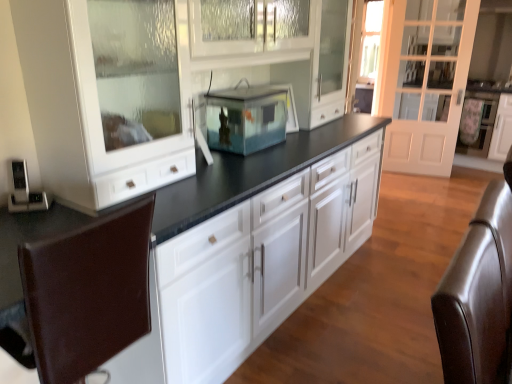
Question: Considering the relative sizes of white glass door at right and brown leather swivel chair at right, marked as the 1th swivel chair in a right-to-left arrangement, in the image provided, is white glass door at right shorter than brown leather swivel chair at right, marked as the 1th swivel chair in a right-to-left arrangement,?

Choices:
 (A) yes
 (B) no

Answer: (B)

Question: Does white glass door at right have a greater width compared to brown leather swivel chair at right, the 2th swivel chair viewed from the left?

Choices:
 (A) yes
 (B) no

Answer: (B)

Question: Is white glass door at right behind brown leather swivel chair at right, marked as the 1th swivel chair in a right-to-left arrangement?

Choices:
 (A) yes
 (B) no

Answer: (A)

Question: Does white glass door at right appear on the left side of brown leather swivel chair at right, marked as the 1th swivel chair in a right-to-left arrangement?

Choices:
 (A) yes
 (B) no

Answer: (B)

Question: From a real-world perspective, is white glass door at right over brown leather swivel chair at right, the 2th swivel chair viewed from the left?

Choices:
 (A) yes
 (B) no

Answer: (A)

Question: Considering the relative positions of brown leather swivel chair at right, marked as the 1th swivel chair in a right-to-left arrangement, and brown leather swivel chair at lower left, which is counted as the first swivel chair, starting from the left, in the image provided, is brown leather swivel chair at right, marked as the 1th swivel chair in a right-to-left arrangement, to the left or to the right of brown leather swivel chair at lower left, which is counted as the first swivel chair, starting from the left,?

Choices:
 (A) right
 (B) left

Answer: (A)

Question: From a real-world perspective, is brown leather swivel chair at right, marked as the 1th swivel chair in a right-to-left arrangement, physically located above or below brown leather swivel chair at lower left, the second swivel chair when ordered from right to left?

Choices:
 (A) below
 (B) above

Answer: (B)

Question: Considering the positions of brown leather swivel chair at right, the 2th swivel chair viewed from the left, and brown leather swivel chair at lower left, the second swivel chair when ordered from right to left, in the image, is brown leather swivel chair at right, the 2th swivel chair viewed from the left, wider or thinner than brown leather swivel chair at lower left, the second swivel chair when ordered from right to left,?

Choices:
 (A) wide
 (B) thin

Answer: (B)

Question: From the image's perspective, is brown leather swivel chair at right, marked as the 1th swivel chair in a right-to-left arrangement, positioned above or below brown leather swivel chair at lower left, the second swivel chair when ordered from right to left?

Choices:
 (A) above
 (B) below

Answer: (A)

Question: From their relative heights in the image, would you say white glass door at right is taller or shorter than transparent glass fish tank at center?

Choices:
 (A) short
 (B) tall

Answer: (B)

Question: Considering the positions of white glass door at right and transparent glass fish tank at center in the image, is white glass door at right wider or thinner than transparent glass fish tank at center?

Choices:
 (A) thin
 (B) wide

Answer: (A)

Question: Relative to transparent glass fish tank at center, is white glass door at right in front or behind?

Choices:
 (A) front
 (B) behind

Answer: (B)

Question: Considering the positions of point coord(415,72) and point coord(219,94), is point coord(415,72) closer or farther from the camera than point coord(219,94)?

Choices:
 (A) closer
 (B) farther

Answer: (B)

Question: Would you say white glossy cabinet at center is inside or outside brown leather swivel chair at lower left, the second swivel chair when ordered from right to left?

Choices:
 (A) inside
 (B) outside

Answer: (B)

Question: Considering the positions of point (368, 228) and point (152, 210), is point (368, 228) closer or farther from the camera than point (152, 210)?

Choices:
 (A) farther
 (B) closer

Answer: (A)